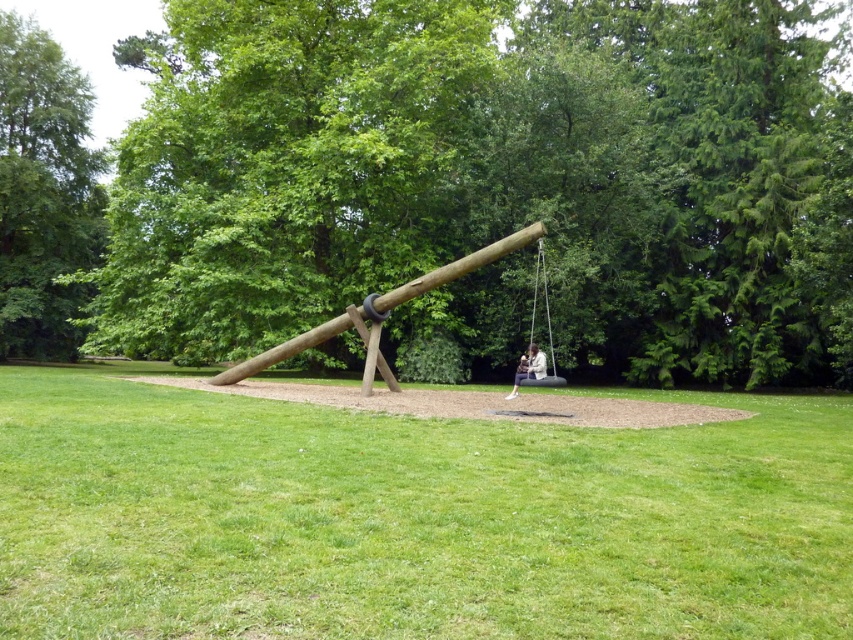
Is brown wood swing at center above white fabric swing at center?

Yes, brown wood swing at center is above white fabric swing at center.

Between point (798, 12) and point (543, 278), which one is positioned in front?

Point (543, 278) is in front.

Where is `brown wood swing at center`? brown wood swing at center is located at coordinates (444, 179).

Who is positioned more to the left, brown wood swing at center or green leafy tree at left?

Answer: green leafy tree at left

Is brown wood swing at center taller than green leafy tree at left?

Yes, brown wood swing at center is taller than green leafy tree at left.

Locate an element on the screen. brown wood swing at center is located at coordinates (444, 179).

At what (x,y) coordinates should I click in order to perform the action: click on brown wood swing at center. Please return your answer as a coordinate pair (x, y). Looking at the image, I should click on (444, 179).

Is point (808, 109) closer to viewer compared to point (525, 369)?

No.

What do you see at coordinates (444, 179) in the screenshot?
I see `brown wood swing at center` at bounding box center [444, 179].

Image resolution: width=853 pixels, height=640 pixels. Find the location of `brown wood swing at center`. brown wood swing at center is located at coordinates (444, 179).